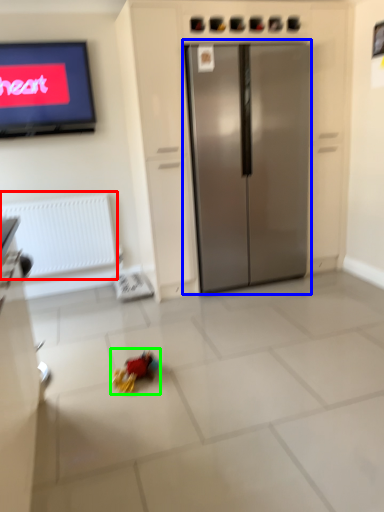
Question: Which object is positioned closest to radiator (highlighted by a red box)? Select from refrigerator (highlighted by a blue box) and miniature (highlighted by a green box).

Choices:
 (A) refrigerator
 (B) miniature

Answer: (A)